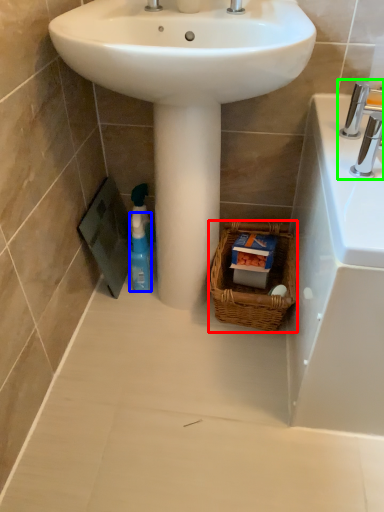
Question: Considering the real-world distances, which object is closest to basket (highlighted by a red box)? cleaning product (highlighted by a blue box) or tap (highlighted by a green box).

Choices:
 (A) cleaning product
 (B) tap

Answer: (A)